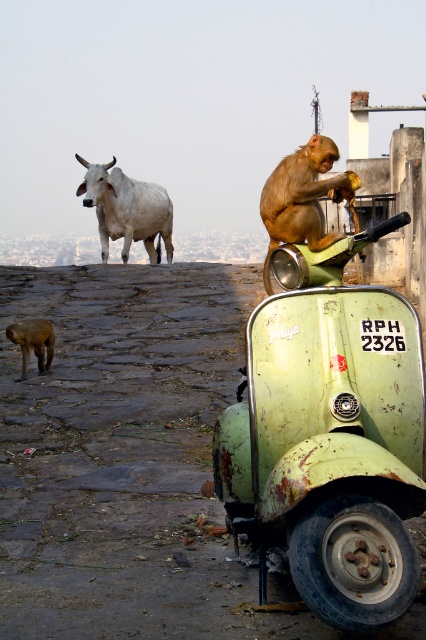
Question: Is brown furry monkey at center thinner than brown furry dog at lower left?

Choices:
 (A) no
 (B) yes

Answer: (A)

Question: Is white smooth cow at upper left to the right of brown furry dog at lower left from the viewer's perspective?

Choices:
 (A) no
 (B) yes

Answer: (B)

Question: From the image, what is the correct spatial relationship of white smooth cow at upper left in relation to brown furry dog at lower left?

Choices:
 (A) right
 (B) left

Answer: (A)

Question: Which of the following is the farthest from the observer?

Choices:
 (A) brown furry monkey at center
 (B) brown furry dog at lower left

Answer: (B)

Question: Which of the following is the closest to the observer?

Choices:
 (A) (86, 173)
 (B) (37, 324)

Answer: (B)

Question: Which object is farther from the camera taking this photo?

Choices:
 (A) brown furry monkey at center
 (B) white smooth cow at upper left
 (C) brown furry dog at lower left

Answer: (B)